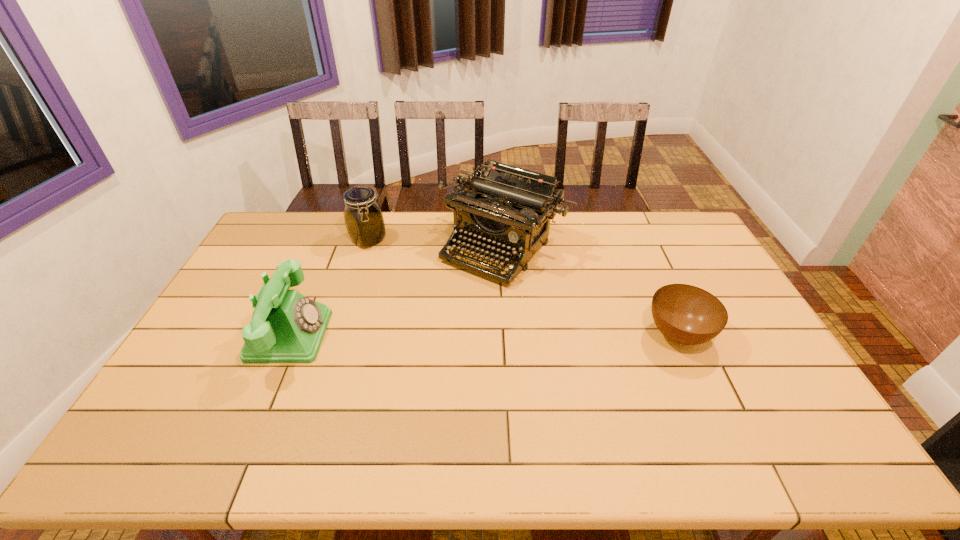
This screenshot has width=960, height=540. Find the location of `free region located 0.180m on the lid of the jar`. free region located 0.180m on the lid of the jar is located at coordinates pyautogui.click(x=410, y=271).

Where is `free space located 0.240m on the keyboard of the second object from right to left`? free space located 0.240m on the keyboard of the second object from right to left is located at coordinates (429, 329).

Identify the location of vacant space located 0.250m on the keyboard of the second object from right to left. This screenshot has height=540, width=960. (427, 332).

Where is `blank space located 0.200m on the keyboard of the second object from right to left`? This screenshot has width=960, height=540. blank space located 0.200m on the keyboard of the second object from right to left is located at coordinates (437, 321).

Locate an element on the screen. The width and height of the screenshot is (960, 540). jar that is positioned at the far edge is located at coordinates (364, 221).

Locate an element on the screen. typewriter at the far edge is located at coordinates (509, 210).

This screenshot has height=540, width=960. I want to click on object situated at the right edge, so click(686, 314).

The width and height of the screenshot is (960, 540). Find the location of `vacant space at the far edge of the desktop`. vacant space at the far edge of the desktop is located at coordinates (409, 243).

This screenshot has height=540, width=960. I want to click on blank space at the near edge of the desktop, so click(437, 414).

I want to click on free spot at the left edge of the desktop, so pos(229,289).